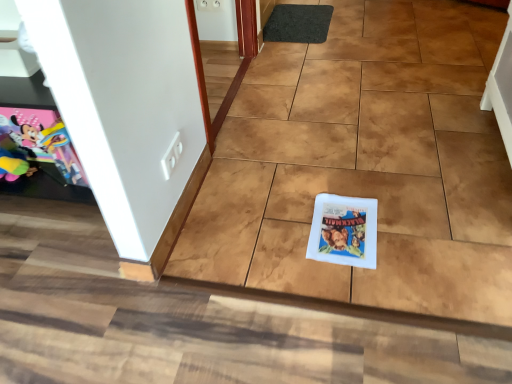
This screenshot has height=384, width=512. Find the location of `unoccupied region to the right of black rubber doormat at upper center`. unoccupied region to the right of black rubber doormat at upper center is located at coordinates (381, 24).